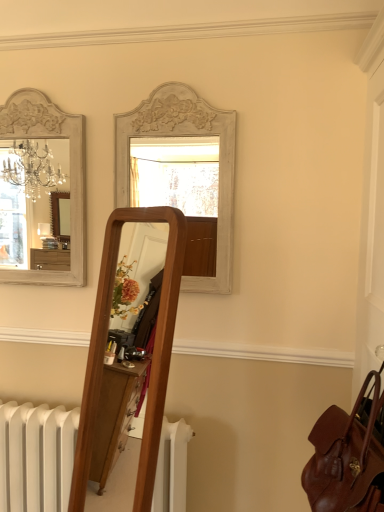
Question: Can you confirm if white painted wood mirror at upper center, positioned as the 2th mirror in left-to-right order, is thinner than leather at right?

Choices:
 (A) no
 (B) yes

Answer: (B)

Question: Does white painted wood mirror at upper center, which is counted as the first mirror, starting from the right, come in front of leather at right?

Choices:
 (A) yes
 (B) no

Answer: (B)

Question: Is white painted wood mirror at upper center, positioned as the 2th mirror in left-to-right order, at the left side of leather at right?

Choices:
 (A) no
 (B) yes

Answer: (B)

Question: Is leather at right surrounded by white painted wood mirror at upper center, which is counted as the first mirror, starting from the right?

Choices:
 (A) no
 (B) yes

Answer: (A)

Question: Is white painted wood mirror at upper center, which is counted as the first mirror, starting from the right, not inside leather at right?

Choices:
 (A) no
 (B) yes

Answer: (B)

Question: Is white painted wood mirror at upper center, positioned as the 2th mirror in left-to-right order, looking in the opposite direction of leather at right?

Choices:
 (A) no
 (B) yes

Answer: (A)

Question: Considering the relative sizes of white painted wood mirror at upper center, positioned as the 2th mirror in left-to-right order, and white painted wood mirror at upper left, the 2th mirror from the right, in the image provided, is white painted wood mirror at upper center, positioned as the 2th mirror in left-to-right order, taller than white painted wood mirror at upper left, the 2th mirror from the right,?

Choices:
 (A) no
 (B) yes

Answer: (A)

Question: Is white painted wood mirror at upper center, which is counted as the first mirror, starting from the right, facing towards white painted wood mirror at upper left, the 2th mirror from the right?

Choices:
 (A) yes
 (B) no

Answer: (B)

Question: Is white painted wood mirror at upper left, the 2th mirror from the right, located within white painted wood mirror at upper center, positioned as the 2th mirror in left-to-right order?

Choices:
 (A) no
 (B) yes

Answer: (A)

Question: From a real-world perspective, is white painted wood mirror at upper center, positioned as the 2th mirror in left-to-right order, below white painted wood mirror at upper left, the 2th mirror from the right?

Choices:
 (A) no
 (B) yes

Answer: (B)

Question: From the image's perspective, would you say white painted wood mirror at upper center, which is counted as the first mirror, starting from the right, is shown under white painted wood mirror at upper left, which is counted as the 1th mirror, starting from the left?

Choices:
 (A) no
 (B) yes

Answer: (B)

Question: Is white painted wood mirror at upper center, which is counted as the first mirror, starting from the right, positioned before white painted wood mirror at upper left, which is counted as the 1th mirror, starting from the left?

Choices:
 (A) no
 (B) yes

Answer: (B)

Question: From the image's perspective, is leather at right located beneath white painted wood mirror at upper center, which is counted as the first mirror, starting from the right?

Choices:
 (A) yes
 (B) no

Answer: (A)